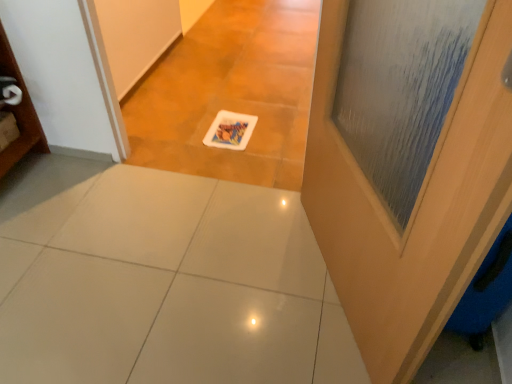
Find the location of a particular element. This screenshot has width=512, height=384. vacant space to the left of wooden door at right is located at coordinates 210,277.